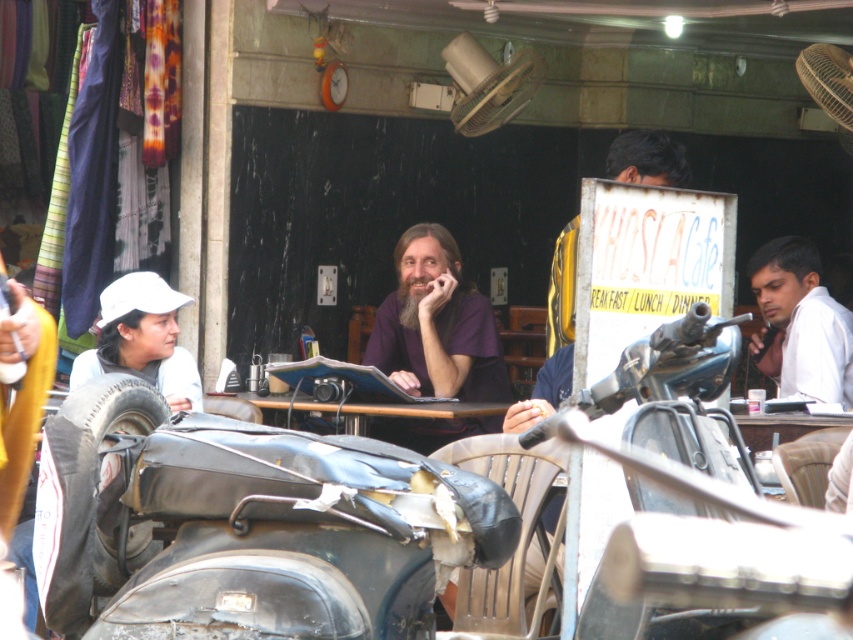
What do you see at coordinates (436, 324) in the screenshot? Image resolution: width=853 pixels, height=640 pixels. I see `dark purple shirt at center` at bounding box center [436, 324].

Which is above, dark purple shirt at center or wooden table at center?

Positioned higher is dark purple shirt at center.

Is point (416, 353) positioned behind point (354, 426)?

Yes, it is behind point (354, 426).

Where is `dark purple shirt at center`? The height and width of the screenshot is (640, 853). dark purple shirt at center is located at coordinates (436, 324).

Does black leather motorcycle at lower left have a smaller size compared to white matte cap at left?

Actually, black leather motorcycle at lower left might be larger than white matte cap at left.

Who is more forward, [480,493] or [96,365]?

Point [480,493] is in front.

Between point (251, 436) and point (195, 401), which one is positioned behind?

The point (195, 401) is more distant.

Locate an element on the screen. This screenshot has width=853, height=640. black leather motorcycle at lower left is located at coordinates (244, 525).

Is dark purple shirt at center to the right of white matte shirt at right from the viewer's perspective?

In fact, dark purple shirt at center is to the left of white matte shirt at right.

Is dark purple shirt at center smaller than white matte shirt at right?

Incorrect, dark purple shirt at center is not smaller in size than white matte shirt at right.

Does point (444, 289) lie behind point (825, 355)?

That is True.

This screenshot has width=853, height=640. In order to click on dark purple shirt at center in this screenshot , I will do `click(436, 324)`.